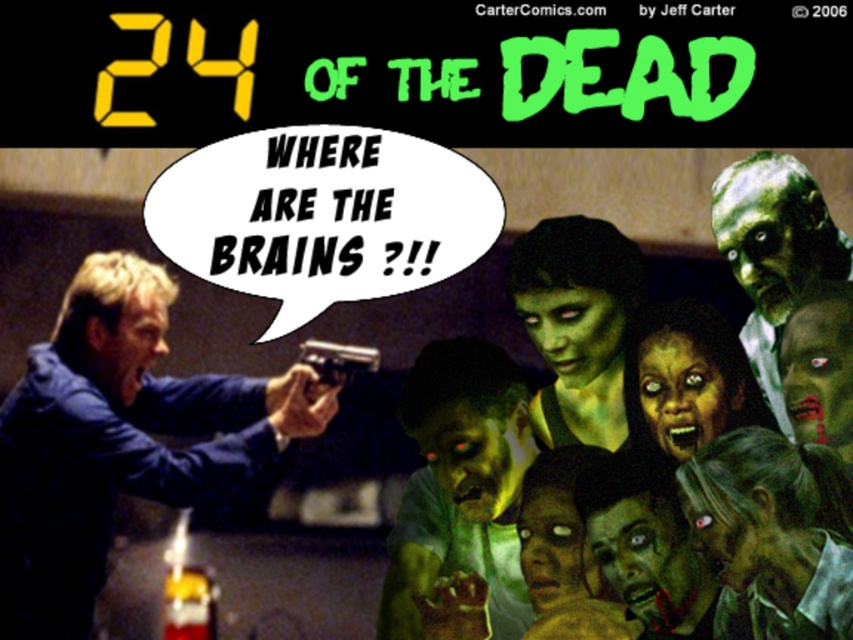
Between point (42, 413) and point (647, 435), which one is positioned in front?

Point (42, 413) is in front.

Identify the location of blue fabric jacket at left. (119, 438).

Does blue fabric jacket at left lie in front of greenish skin zombie at center?

No, it is not.

Who is higher up, blue fabric jacket at left or greenish skin zombie at center?

Positioned higher is greenish skin zombie at center.

Is point (163, 378) positioned before point (833, 276)?

No, (163, 378) is behind (833, 276).

Locate an element on the screen. This screenshot has width=853, height=640. blue fabric jacket at left is located at coordinates [119, 438].

Does green matte face at center appear on the left side of greenish skin zombie at center?

Indeed, green matte face at center is positioned on the left side of greenish skin zombie at center.

Does point (628, 403) come in front of point (840, 248)?

No, (628, 403) is behind (840, 248).

This screenshot has width=853, height=640. Find the location of `green matte face at center`. green matte face at center is located at coordinates (579, 326).